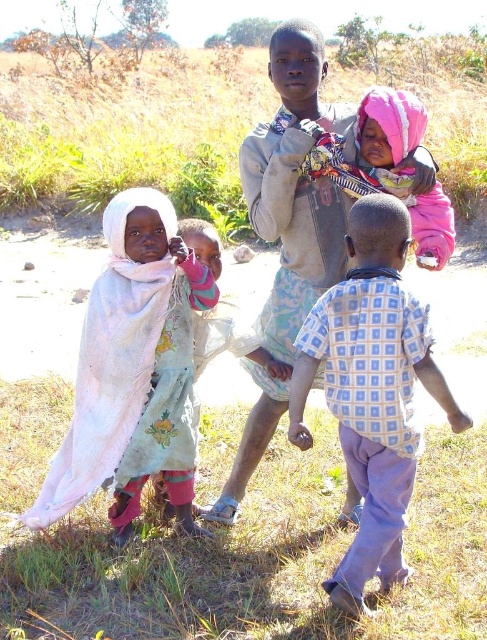
You are a photographer trying to capture a closeup of the blue checkered shirt at center and the pink fabric scarf at upper center. Since you can only focus on one object at a time, which object should you choose to ensure it appears larger in your photo?

Answer: The blue checkered shirt at center has a larger size compared to the pink fabric scarf at upper center, so you should focus on the blue checkered shirt at center to ensure it appears larger in your photo.